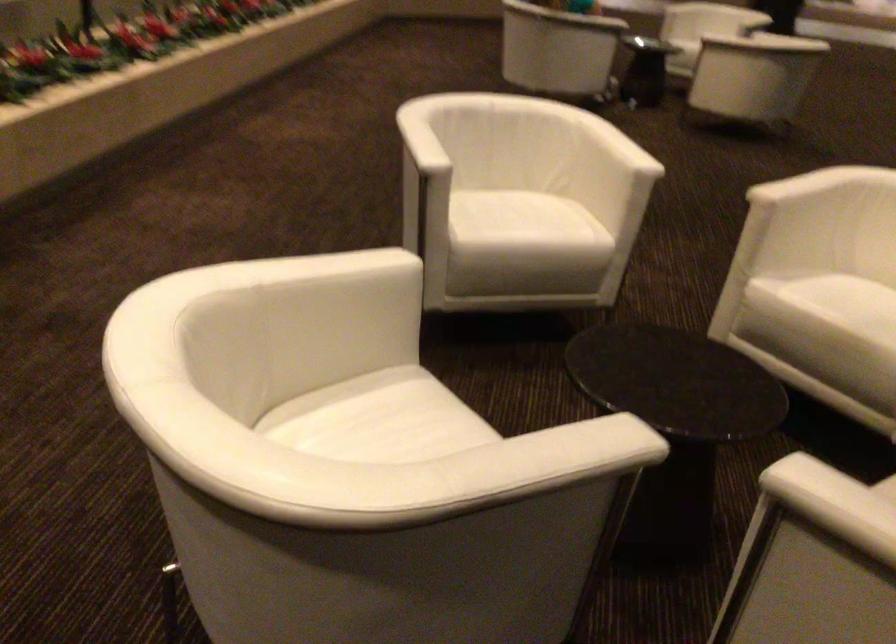
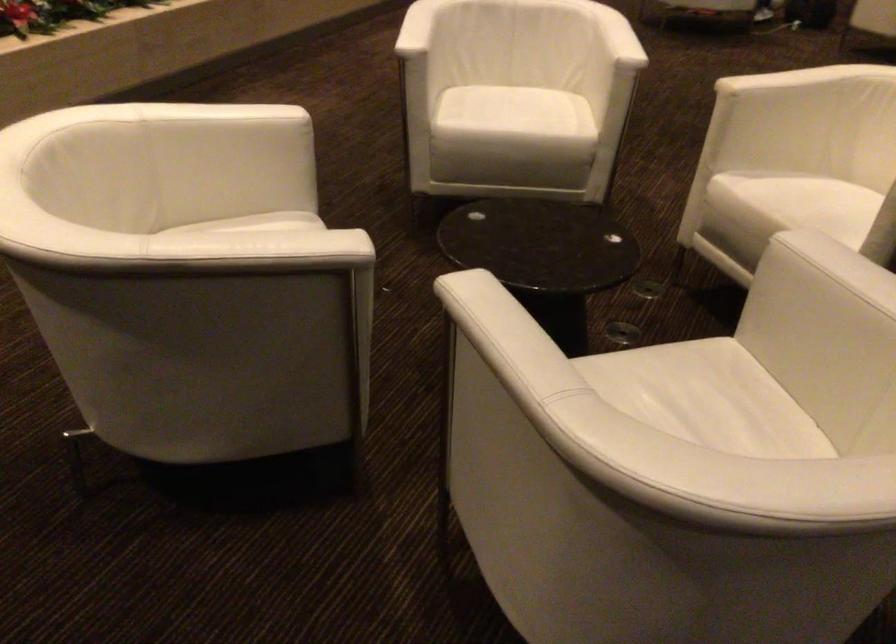
The point at [819,187] is marked in the first image. Where is the corresponding point in the second image?

(789, 80)